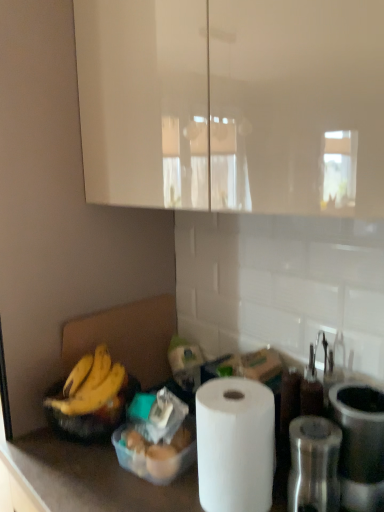
Question: Can you confirm if translucent plastic container at lower center is smaller than yellow matte bananas at lower left?

Choices:
 (A) no
 (B) yes

Answer: (A)

Question: Can you confirm if translucent plastic container at lower center is taller than yellow matte bananas at lower left?

Choices:
 (A) no
 (B) yes

Answer: (B)

Question: Is translucent plastic container at lower center further to the viewer compared to yellow matte bananas at lower left?

Choices:
 (A) no
 (B) yes

Answer: (A)

Question: Is translucent plastic container at lower center beside yellow matte bananas at lower left?

Choices:
 (A) yes
 (B) no

Answer: (B)

Question: Can you confirm if translucent plastic container at lower center is positioned to the right of yellow matte bananas at lower left?

Choices:
 (A) no
 (B) yes

Answer: (B)

Question: Would you say metallic silver canister at right, the second appliance when ordered from left to right, is inside or outside yellow matte bananas at lower left?

Choices:
 (A) outside
 (B) inside

Answer: (A)

Question: In the image, is metallic silver canister at right, the second appliance when ordered from left to right, positioned in front of or behind yellow matte bananas at lower left?

Choices:
 (A) behind
 (B) front

Answer: (B)

Question: In terms of size, does metallic silver canister at right, the second appliance when ordered from left to right, appear bigger or smaller than yellow matte bananas at lower left?

Choices:
 (A) big
 (B) small

Answer: (A)

Question: From the image's perspective, is metallic silver canister at right, the second appliance when ordered from left to right, above or below yellow matte bananas at lower left?

Choices:
 (A) below
 (B) above

Answer: (A)

Question: In terms of width, does yellow matte bananas at lower left look wider or thinner when compared to metallic silver grinder at right, placed as the 1th appliance when sorted from left to right?

Choices:
 (A) wide
 (B) thin

Answer: (A)

Question: Based on their sizes in the image, would you say yellow matte bananas at lower left is bigger or smaller than metallic silver grinder at right, placed as the 1th appliance when sorted from left to right?

Choices:
 (A) big
 (B) small

Answer: (B)

Question: From a real-world perspective, is yellow matte bananas at lower left positioned above or below metallic silver grinder at right, placed as the 1th appliance when sorted from left to right?

Choices:
 (A) below
 (B) above

Answer: (B)

Question: Is yellow matte bananas at lower left inside the boundaries of metallic silver grinder at right, placed as the 1th appliance when sorted from left to right, or outside?

Choices:
 (A) outside
 (B) inside

Answer: (A)

Question: Does point (241, 407) appear closer or farther from the camera than point (72, 412)?

Choices:
 (A) farther
 (B) closer

Answer: (B)

Question: Relative to yellow matte bananas at lower left, is white matte paper towel at lower center in front or behind?

Choices:
 (A) front
 (B) behind

Answer: (A)